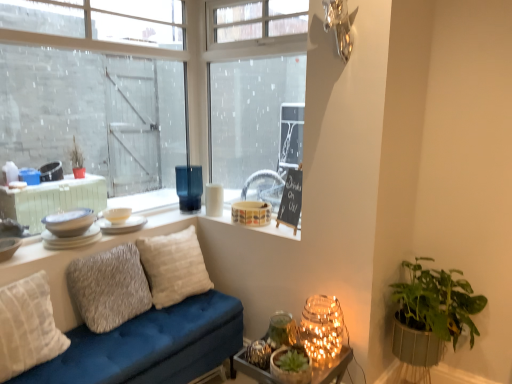
Question: Is green textured pot at lower right, positioned as the first houseplant in left-to-right order, located within matte ceramic bowl at upper center, marked as the 3th candle holder in a left-to-right arrangement?

Choices:
 (A) no
 (B) yes

Answer: (A)

Question: Can you confirm if matte ceramic bowl at upper center, positioned as the 1th candle holder in right-to-left order, is shorter than green textured pot at lower right, positioned as the first houseplant in left-to-right order?

Choices:
 (A) yes
 (B) no

Answer: (A)

Question: From the image's perspective, would you say matte ceramic bowl at upper center, marked as the 3th candle holder in a left-to-right arrangement, is positioned over green textured pot at lower right, positioned as the first houseplant in left-to-right order?

Choices:
 (A) yes
 (B) no

Answer: (A)

Question: Does matte ceramic bowl at upper center, positioned as the 1th candle holder in right-to-left order, have a lesser width compared to green textured pot at lower right, positioned as the first houseplant in left-to-right order?

Choices:
 (A) no
 (B) yes

Answer: (A)

Question: From a real-world perspective, is matte ceramic bowl at upper center, positioned as the 1th candle holder in right-to-left order, beneath green textured pot at lower right, positioned as the first houseplant in left-to-right order?

Choices:
 (A) yes
 (B) no

Answer: (B)

Question: Considering the positions of point (297, 187) and point (92, 235), is point (297, 187) closer or farther from the camera than point (92, 235)?

Choices:
 (A) farther
 (B) closer

Answer: (A)

Question: From a real-world perspective, is black chalkboard at upper center physically located above or below white glossy bowls at upper left, which appears as the 2th tableware when viewed from the front?

Choices:
 (A) above
 (B) below

Answer: (A)

Question: Do you think black chalkboard at upper center is within white glossy bowls at upper left, the 3th tableware positioned from the back, or outside of it?

Choices:
 (A) inside
 (B) outside

Answer: (B)

Question: In terms of size, does black chalkboard at upper center appear bigger or smaller than white glossy bowls at upper left, which appears as the 2th tableware when viewed from the front?

Choices:
 (A) big
 (B) small

Answer: (A)

Question: Is matte white plate at upper left, the second tableware viewed from the back, to the left or to the right of matte ceramic bowl at upper center, positioned as the 1th candle holder in right-to-left order, in the image?

Choices:
 (A) right
 (B) left

Answer: (B)

Question: Is point (138, 228) closer or farther from the camera than point (245, 223)?

Choices:
 (A) closer
 (B) farther

Answer: (A)

Question: Considering the positions of matte white plate at upper left, which appears as the third tableware when viewed from the front, and matte ceramic bowl at upper center, positioned as the 1th candle holder in right-to-left order, in the image, is matte white plate at upper left, which appears as the third tableware when viewed from the front, wider or thinner than matte ceramic bowl at upper center, positioned as the 1th candle holder in right-to-left order,?

Choices:
 (A) thin
 (B) wide

Answer: (B)

Question: Is matte white plate at upper left, which appears as the third tableware when viewed from the front, inside the boundaries of matte ceramic bowl at upper center, positioned as the 1th candle holder in right-to-left order, or outside?

Choices:
 (A) inside
 (B) outside

Answer: (B)

Question: From the image's perspective, is green leafy plant in woven basket at lower right, arranged as the second houseplant when viewed from the left, positioned above or below matte ceramic bowl at upper center, positioned as the 1th candle holder in right-to-left order?

Choices:
 (A) above
 (B) below

Answer: (B)

Question: From their relative heights in the image, would you say green leafy plant in woven basket at lower right, arranged as the second houseplant when viewed from the left, is taller or shorter than matte ceramic bowl at upper center, positioned as the 1th candle holder in right-to-left order?

Choices:
 (A) tall
 (B) short

Answer: (A)